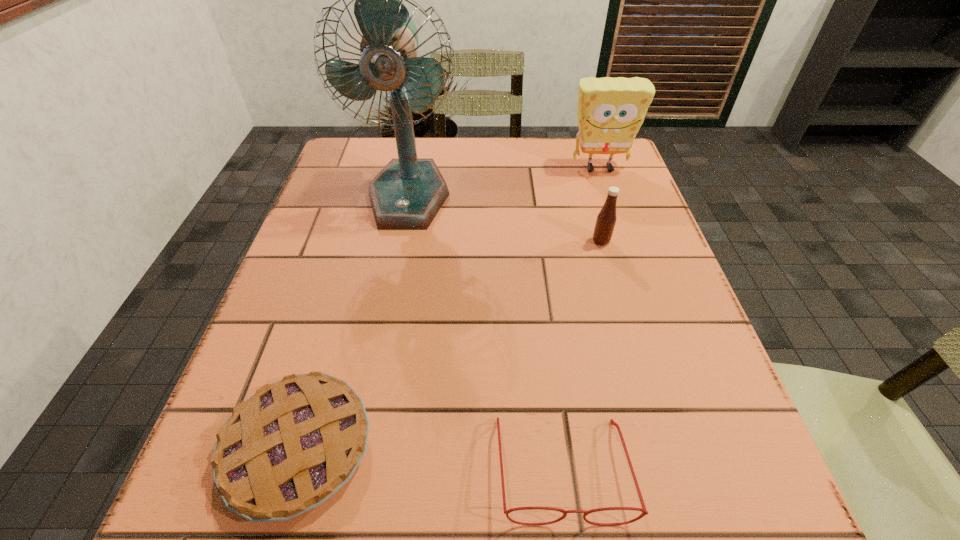
Locate an element on the screen. fan is located at coordinates (407, 194).

You are a GUI agent. You are given a task and a screenshot of the screen. Output one action in this format:
    pyautogui.click(x=<x>, y=<y>)
    Task: Click on the sponge
    Image resolution: width=960 pixels, height=540 pixels.
    Given the screenshot: What is the action you would take?
    pyautogui.click(x=610, y=112)

Identify the location of the third tallest object. This screenshot has height=540, width=960. (606, 219).

Where is `the third nearest object`? The image size is (960, 540). the third nearest object is located at coordinates (606, 219).

In order to click on the second shortest object in this screenshot , I will do `click(644, 512)`.

At what (x,y) coordinates should I click in order to perform the action: click on spectacles. Please return your answer as a coordinate pair (x, y). The width and height of the screenshot is (960, 540). Looking at the image, I should click on (644, 512).

Identify the location of the shortest object. (285, 450).

You are a GUI agent. You are given a task and a screenshot of the screen. Output one action in this format:
    pyautogui.click(x=<x>, y=<y>)
    Task: Click on the vacant area located in front of the tallest object where the wind blows
    The height and width of the screenshot is (540, 960).
    Given the screenshot: What is the action you would take?
    pyautogui.click(x=378, y=357)

Identify the location of vacant space situated 0.380m on the face of the sponge. (641, 291).

What are the coordinates of `vacant region located on the left of the third shortest object` in the screenshot? It's located at (517, 241).